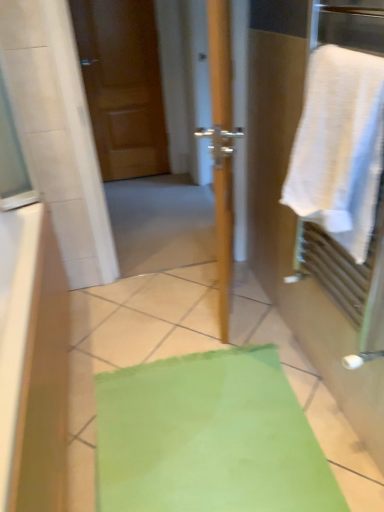
Image resolution: width=384 pixels, height=512 pixels. What do you see at coordinates (122, 85) in the screenshot? I see `matte wood door at upper left` at bounding box center [122, 85].

Identify the location of wooden door at center. The image size is (384, 512). (122, 85).

The width and height of the screenshot is (384, 512). Identify the location of matte wood door at upper left. (122, 85).

Based on the photo, from the image's perspective, is matte wood door at upper left above wooden door at center?

Yes.

Considering the sizes of objects matte wood door at upper left and wooden door at center in the image provided, who is shorter, matte wood door at upper left or wooden door at center?

With less height is matte wood door at upper left.

Is matte wood door at upper left not within wooden door at center?

Yes, matte wood door at upper left is outside of wooden door at center.

Who is more distant, matte wood door at upper left or wooden door at center?

Positioned behind is matte wood door at upper left.

Looking at this image, is white cotton towel at right smaller than wooden door at center?

Yes.

In the scene shown: Which object is closer to the camera, white cotton towel at right or wooden door at center?

white cotton towel at right is in front.

In terms of width, does white cotton towel at right look wider or thinner when compared to wooden door at center?

white cotton towel at right is wider than wooden door at center.

Can you confirm if wooden door at center is positioned to the right of white cotton towel at right?

In fact, wooden door at center is to the left of white cotton towel at right.

In order to click on screen door below the white cotton towel at right (from a real-world perspective) in this screenshot , I will do `click(122, 85)`.

How different are the orientations of wooden door at center and white cotton towel at right in degrees?

There is a 88.6-degree angle between the facing directions of wooden door at center and white cotton towel at right.

Considering the points (222, 326) and (361, 221), which point is behind, point (222, 326) or point (361, 221)?

Point (222, 326)

Is matte wood door at upper left bigger than white cotton towel at right?

Yes, matte wood door at upper left is bigger than white cotton towel at right.

Are matte wood door at upper left and white cotton towel at right beside each other?

matte wood door at upper left and white cotton towel at right are clearly separated.

Is white cotton towel at right surrounded by matte wood door at upper left?

Actually, white cotton towel at right is outside matte wood door at upper left.

Can you tell me how much matte wood door at upper left and white cotton towel at right differ in facing direction?

The angular difference between matte wood door at upper left and white cotton towel at right is 89.2 degrees.

Considering the relative sizes of white cotton towel at right and matte wood door at upper left in the image provided, is white cotton towel at right shorter than matte wood door at upper left?

Yes.

Which object is more forward, white cotton towel at right or matte wood door at upper left?

white cotton towel at right is in front.

Is matte wood door at upper left at the back of white cotton towel at right?

No, white cotton towel at right is not facing the opposite direction of matte wood door at upper left.

Which point is more distant from viewer, (373,120) or (126,173)?

The point (126,173) is farther.

Is wooden door at center shorter than matte wood door at upper left?

Incorrect, the height of wooden door at center does not fall short of that of matte wood door at upper left.

Is wooden door at center located outside matte wood door at upper left?

That's correct, wooden door at center is outside of matte wood door at upper left.

How many degrees apart are the facing directions of wooden door at center and matte wood door at upper left?

The angle between the facing direction of wooden door at center and the facing direction of matte wood door at upper left is 0.626 degrees.

You are a GUI agent. You are given a task and a screenshot of the screen. Output one action in this format:
    pyautogui.click(x=<x>, y=<y>)
    Task: Click on the screen door below the matte wood door at upper left (from the image's perspective)
    The image size is (384, 512).
    Given the screenshot: What is the action you would take?
    pyautogui.click(x=122, y=85)

The width and height of the screenshot is (384, 512). I want to click on towel in front of the wooden door at center, so click(x=339, y=147).

Estimate the real-world distances between objects in this image. Which object is closer to wooden door at center, matte wood door at upper left or white cotton towel at right?

matte wood door at upper left.

Which object lies nearer to the anchor point wooden door at center, white cotton towel at right or matte wood door at upper left?

matte wood door at upper left lies closer to wooden door at center than the other object.

Looking at the image, which one is located further to white cotton towel at right, wooden door at center or matte wood door at upper left?

Among the two, wooden door at center is located further to white cotton towel at right.

Estimate the real-world distances between objects in this image. Which object is closer to matte wood door at upper left, wooden door at center or white cotton towel at right?

The object closer to matte wood door at upper left is wooden door at center.

Which object lies nearer to the anchor point white cotton towel at right, matte wood door at upper left or wooden door at center?

matte wood door at upper left.

In the scene shown: Estimate the real-world distances between objects in this image. Which object is further from matte wood door at upper left, white cotton towel at right or wooden door at center?

The object further to matte wood door at upper left is white cotton towel at right.

You are a GUI agent. You are given a task and a screenshot of the screen. Output one action in this format:
    pyautogui.click(x=<x>, y=<y>)
    Task: Click on the screen door between white cotton towel at right and matte wood door at upper left in the front-back direction
    
    Given the screenshot: What is the action you would take?
    pyautogui.click(x=122, y=85)